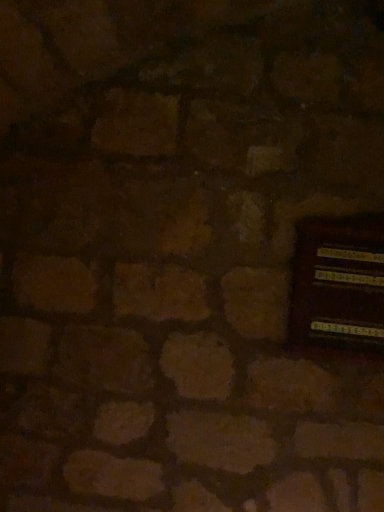
From the picture: Measure the distance between point (307,272) and camera.

A distance of 4.05 feet exists between point (307,272) and camera.

Image resolution: width=384 pixels, height=512 pixels. Find the location of `wooden panel at right`. wooden panel at right is located at coordinates (339, 284).

Describe the element at coordinates (339, 284) in the screenshot. This screenshot has width=384, height=512. I see `wooden panel at right` at that location.

Image resolution: width=384 pixels, height=512 pixels. I want to click on wooden panel at right, so click(339, 284).